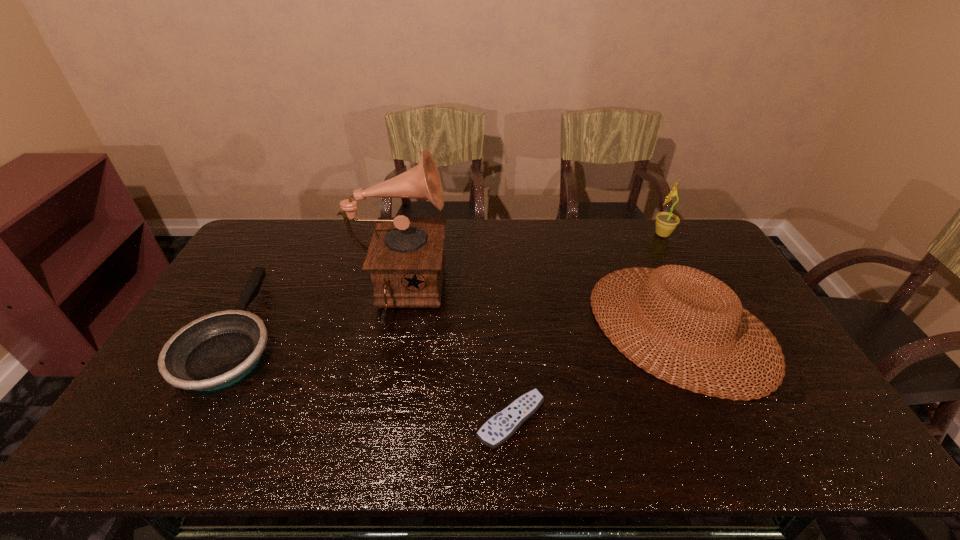
You are a GUI agent. You are given a task and a screenshot of the screen. Output one action in this format:
    pyautogui.click(x=<x>, y=<y>)
    Task: Click on the object at the left edge
    
    Given the screenshot: What is the action you would take?
    pyautogui.click(x=217, y=350)

At what (x,y) coordinates should I click in order to perform the action: click on sunflower that is at the right edge. Please return your answer as a coordinate pair (x, y). Image resolution: width=960 pixels, height=540 pixels. Looking at the image, I should click on (666, 222).

At what (x,y) coordinates should I click in order to perform the action: click on sunhat at the right edge. Please return your answer as a coordinate pair (x, y). Looking at the image, I should click on (733, 313).

The width and height of the screenshot is (960, 540). I want to click on object positioned at the far right corner, so click(x=666, y=222).

Where is `vacant space at the far edge of the desktop`? vacant space at the far edge of the desktop is located at coordinates pos(464,226).

Image resolution: width=960 pixels, height=540 pixels. I want to click on free space at the right edge of the desktop, so click(x=692, y=267).

This screenshot has height=540, width=960. In the image, there is a desktop. In order to click on vacant space at the far left corner in this screenshot , I will do `click(288, 227)`.

What are the coordinates of `vacant area that lies between the second shortest object and the farthest object` in the screenshot? It's located at (450, 283).

In order to click on vacant space that's between the record player and the fourth tallest object in this screenshot , I will do tap(318, 314).

This screenshot has width=960, height=540. I want to click on vacant space in between the third shortest object and the remote control, so click(595, 373).